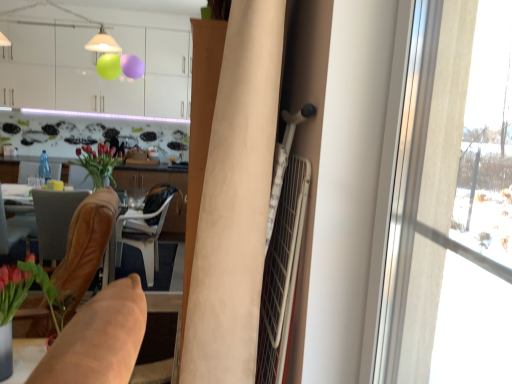
Question: Is white plastic chair at center, which appears as the first chair when viewed from the back, shorter than brown leather chair at lower left, which is the second chair from back to front?

Choices:
 (A) yes
 (B) no

Answer: (B)

Question: Would you consider white plastic chair at center, which ranks as the 3th chair in front-to-back order, to be distant from brown leather chair at lower left, arranged as the second chair when viewed from the front?

Choices:
 (A) no
 (B) yes

Answer: (A)

Question: From a real-world perspective, is white plastic chair at center, which ranks as the 3th chair in front-to-back order, below brown leather chair at lower left, which is the second chair from back to front?

Choices:
 (A) no
 (B) yes

Answer: (B)

Question: From the image's perspective, is white plastic chair at center, which appears as the first chair when viewed from the back, over brown leather chair at lower left, arranged as the second chair when viewed from the front?

Choices:
 (A) no
 (B) yes

Answer: (A)

Question: Can you confirm if white plastic chair at center, which appears as the first chair when viewed from the back, is positioned to the left of brown leather chair at lower left, which is the second chair from back to front?

Choices:
 (A) no
 (B) yes

Answer: (A)

Question: Looking at the image, does brown leather chair at left, which is the third chair in back-to-front order, seem bigger or smaller compared to transparent glass window at right?

Choices:
 (A) big
 (B) small

Answer: (A)

Question: From the image's perspective, is brown leather chair at left, which is the third chair in back-to-front order, located above or below transparent glass window at right?

Choices:
 (A) below
 (B) above

Answer: (A)

Question: In terms of width, does brown leather chair at left, marked as the 1th chair in a front-to-back arrangement, look wider or thinner when compared to transparent glass window at right?

Choices:
 (A) thin
 (B) wide

Answer: (B)

Question: Relative to transparent glass window at right, is brown leather chair at left, marked as the 1th chair in a front-to-back arrangement, in front or behind?

Choices:
 (A) behind
 (B) front

Answer: (A)

Question: Considering the positions of point (44, 155) and point (45, 59), is point (44, 155) closer or farther from the camera than point (45, 59)?

Choices:
 (A) farther
 (B) closer

Answer: (B)

Question: From a real-world perspective, is transparent glass bottle at center above or below white glossy cabinets at upper center?

Choices:
 (A) below
 (B) above

Answer: (A)

Question: From the image's perspective, is transparent glass bottle at center located above or below white glossy cabinets at upper center?

Choices:
 (A) above
 (B) below

Answer: (B)

Question: Is transparent glass bottle at center in front of or behind white glossy cabinets at upper center in the image?

Choices:
 (A) behind
 (B) front

Answer: (B)

Question: Considering the positions of point (158, 183) and point (403, 367), is point (158, 183) closer or farther from the camera than point (403, 367)?

Choices:
 (A) farther
 (B) closer

Answer: (A)

Question: Visually, is white plastic chair at center, which ranks as the 3th chair in front-to-back order, positioned to the left or to the right of transparent glass window at right?

Choices:
 (A) left
 (B) right

Answer: (A)